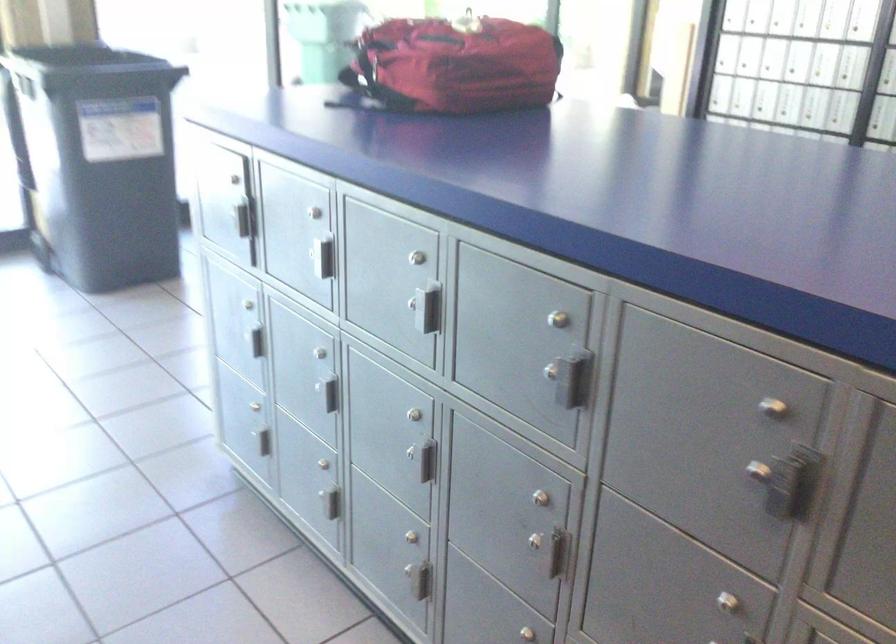
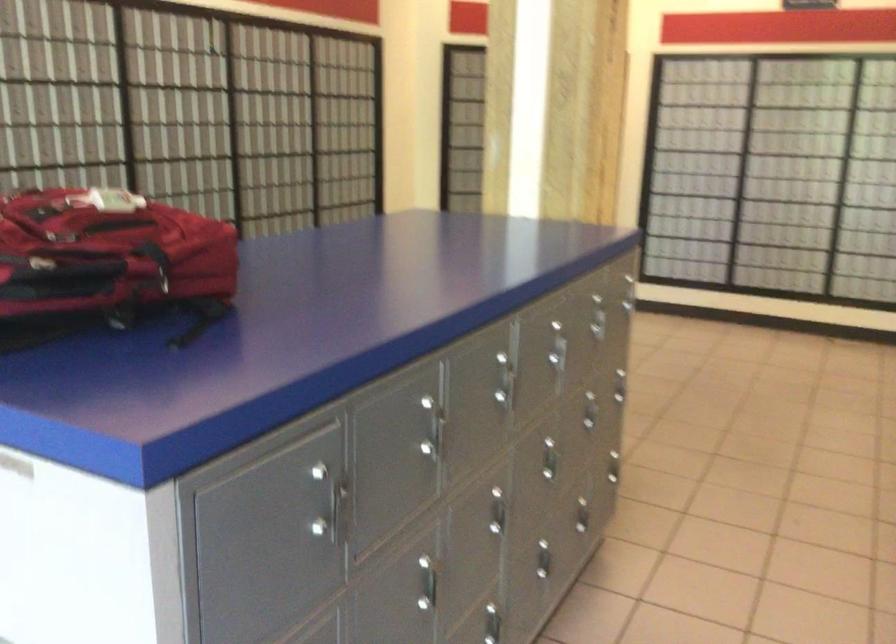
Locate, in the second image, the point that corresponds to point 338,260 in the first image.

(444, 431)